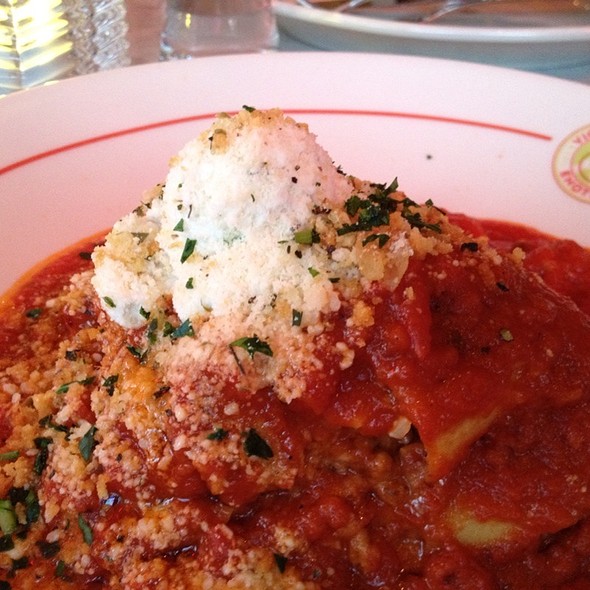
Locate an element on the screen. white round bowl is located at coordinates (547, 53).